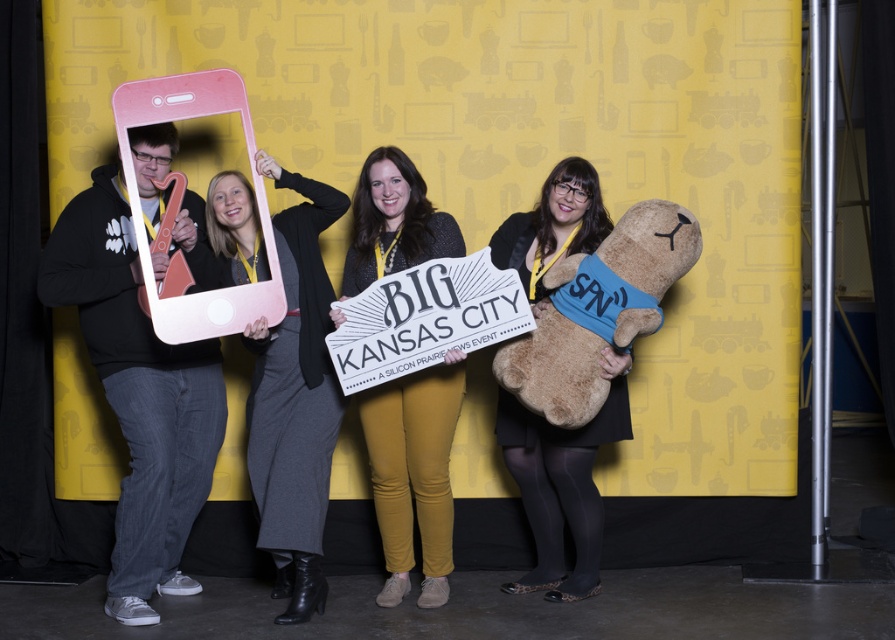
Question: Among these points, which one is farthest from the camera?

Choices:
 (A) (168, 234)
 (B) (287, 246)

Answer: (B)

Question: Does gray woolen pants at center appear under matte black teddy bear at center?

Choices:
 (A) yes
 (B) no

Answer: (B)

Question: Is gray woolen pants at center closer to the viewer compared to mustard yellow leggings at center?

Choices:
 (A) yes
 (B) no

Answer: (A)

Question: Does matte pink phone at left appear over brown plush at right?

Choices:
 (A) yes
 (B) no

Answer: (B)

Question: Among these objects, which one is farthest from the camera?

Choices:
 (A) mustard yellow leggings at center
 (B) matte black teddy bear at center
 (C) matte pink phone at left

Answer: (A)

Question: Which object is the farthest from the matte pink phone at left?

Choices:
 (A) mustard yellow leggings at center
 (B) brown plush at right
 (C) gray woolen pants at center
 (D) matte black teddy bear at center

Answer: (B)